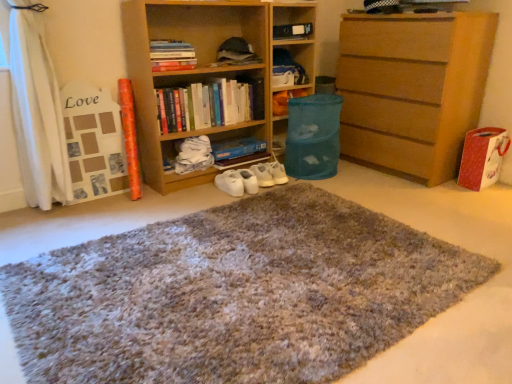
Image resolution: width=512 pixels, height=384 pixels. I want to click on vacant space that is in between light brown wooden chest of drawers at right and blue fabric bean bag chair at center, so coord(360,182).